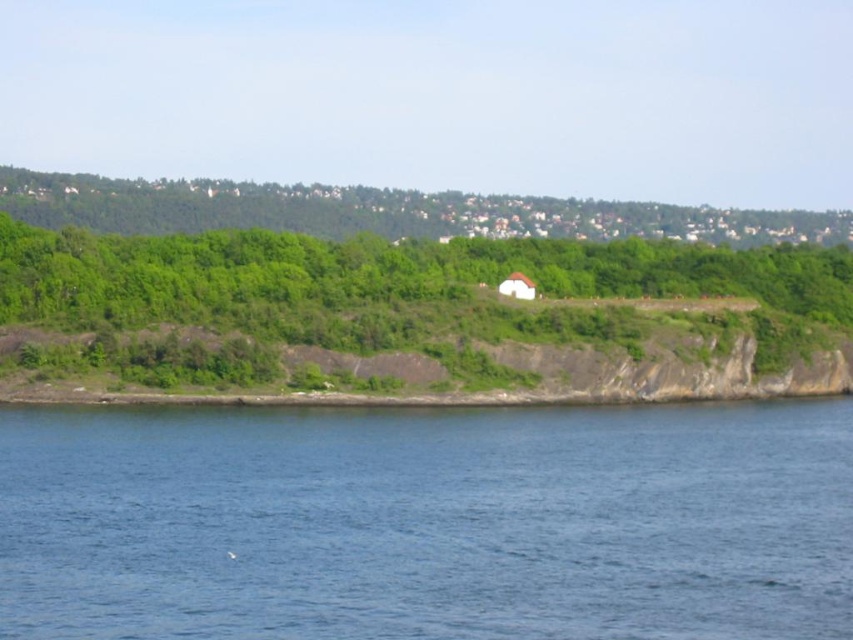
You are standing at the center of the image and want to walk to the blue liquid water at lower center. What direction should you move in?

You should move downward since the blue liquid water at lower center is located at point (427, 522), which is below your current position at the center.

You are standing at the edge of the water in the coastal landscape. You want to walk to the trees. Is the path from the blue liquid water at lower center to the green leafy trees at upper center uphill or downhill?

The path from the blue liquid water at lower center to the green leafy trees at upper center is uphill because the water has a lesser height compared to the trees, indicating the terrain rises towards the trees.